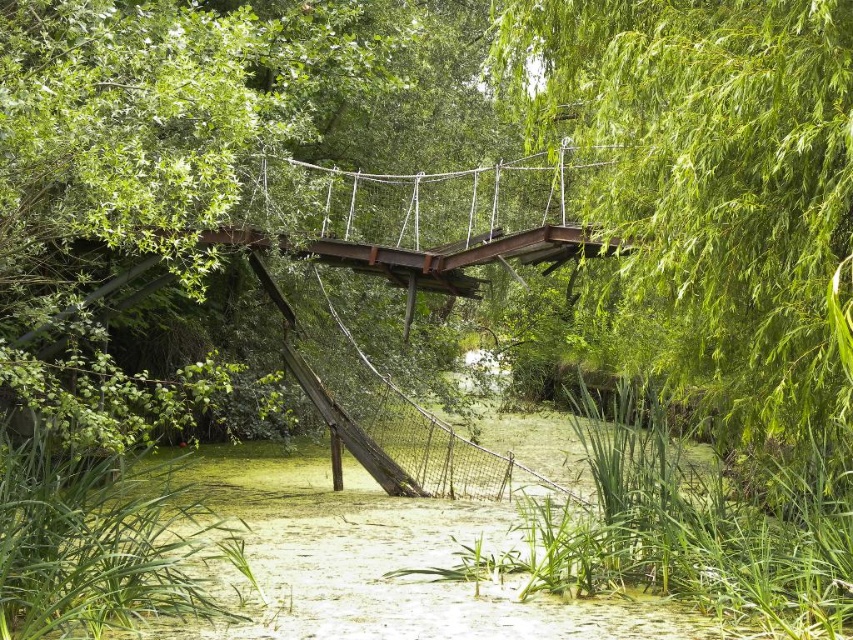
Is green leafy tree at upper right above rusty metal suspension bridge at center?

Yes, green leafy tree at upper right is above rusty metal suspension bridge at center.

Does green leafy tree at upper right have a greater height compared to rusty metal suspension bridge at center?

Correct, green leafy tree at upper right is much taller as rusty metal suspension bridge at center.

Between point (648, 3) and point (567, 177), which one is positioned behind?

Positioned behind is point (567, 177).

At what (x,y) coordinates should I click in order to perform the action: click on green leafy tree at upper right. Please return your answer as a coordinate pair (x, y). This screenshot has height=640, width=853. Looking at the image, I should click on (706, 180).